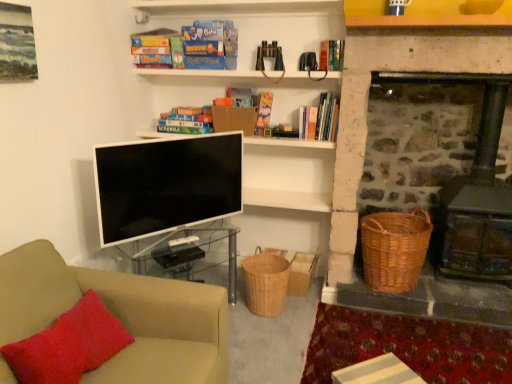
Question: Does matte cardboard book at upper center, which is the fourth book in right-to-left order, have a greater width compared to woven brown basket at lower center, which is the second basket from left to right?

Choices:
 (A) no
 (B) yes

Answer: (A)

Question: Can woven brown basket at lower center, which is the second basket from left to right, be found inside matte cardboard book at upper center, which is the fourth book in right-to-left order?

Choices:
 (A) no
 (B) yes

Answer: (A)

Question: Considering the relative sizes of matte cardboard book at upper center, the second book in the left-to-right sequence, and woven brown basket at lower center, which is the second basket from left to right, in the image provided, is matte cardboard book at upper center, the second book in the left-to-right sequence, thinner than woven brown basket at lower center, which is the second basket from left to right,?

Choices:
 (A) no
 (B) yes

Answer: (B)

Question: Considering the relative sizes of matte cardboard book at upper center, the second book in the left-to-right sequence, and woven brown basket at lower center, which is the second basket from left to right, in the image provided, is matte cardboard book at upper center, the second book in the left-to-right sequence, shorter than woven brown basket at lower center, which is the second basket from left to right,?

Choices:
 (A) yes
 (B) no

Answer: (A)

Question: Is matte cardboard book at upper center, the second book in the left-to-right sequence, closer to the viewer compared to woven brown basket at lower center, positioned as the second basket in right-to-left order?

Choices:
 (A) yes
 (B) no

Answer: (B)

Question: Is the position of matte cardboard book at upper center, the second book in the left-to-right sequence, more distant than that of woven brown basket at lower center, positioned as the second basket in right-to-left order?

Choices:
 (A) yes
 (B) no

Answer: (A)

Question: Can you confirm if hardcover book at upper center, placed as the 1th book when sorted from right to left, is shorter than white glossy television at center?

Choices:
 (A) no
 (B) yes

Answer: (B)

Question: From a real-world perspective, is hardcover book at upper center, placed as the 1th book when sorted from right to left, positioned over white glossy television at center based on gravity?

Choices:
 (A) no
 (B) yes

Answer: (B)

Question: Is hardcover book at upper center, placed as the 1th book when sorted from right to left, positioned with its back to white glossy television at center?

Choices:
 (A) no
 (B) yes

Answer: (A)

Question: Is hardcover book at upper center, the 5th book from the left, to the left of white glossy television at center from the viewer's perspective?

Choices:
 (A) yes
 (B) no

Answer: (B)

Question: Considering the relative sizes of hardcover book at upper center, the 5th book from the left, and white glossy television at center in the image provided, is hardcover book at upper center, the 5th book from the left, taller than white glossy television at center?

Choices:
 (A) no
 (B) yes

Answer: (A)

Question: Would you consider hardcover book at upper center, the 5th book from the left, to be distant from white glossy television at center?

Choices:
 (A) no
 (B) yes

Answer: (B)

Question: Is the position of matte cardboard book at upper center, which ranks as the 1th book in left-to-right order, less distant than that of beige fabric couch at lower left?

Choices:
 (A) no
 (B) yes

Answer: (A)